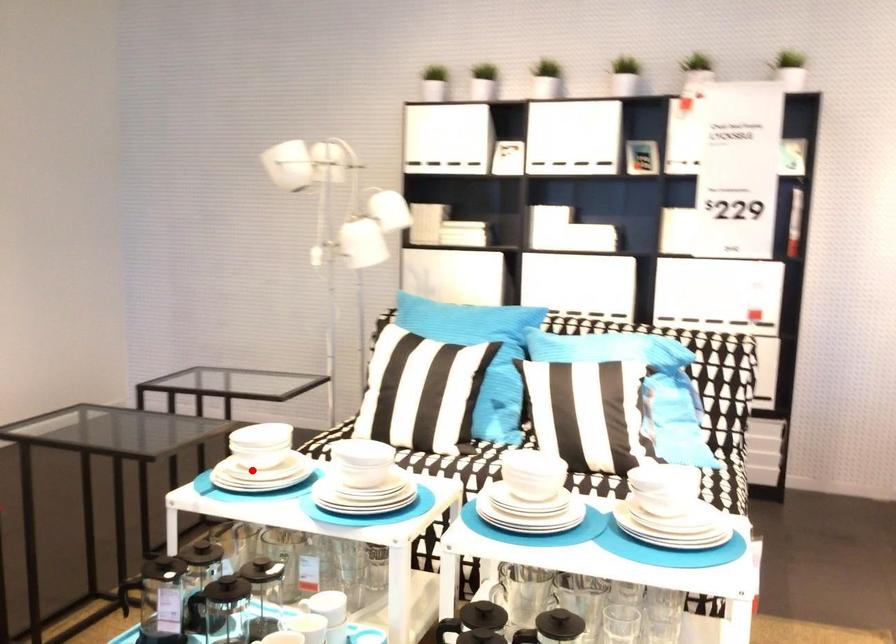
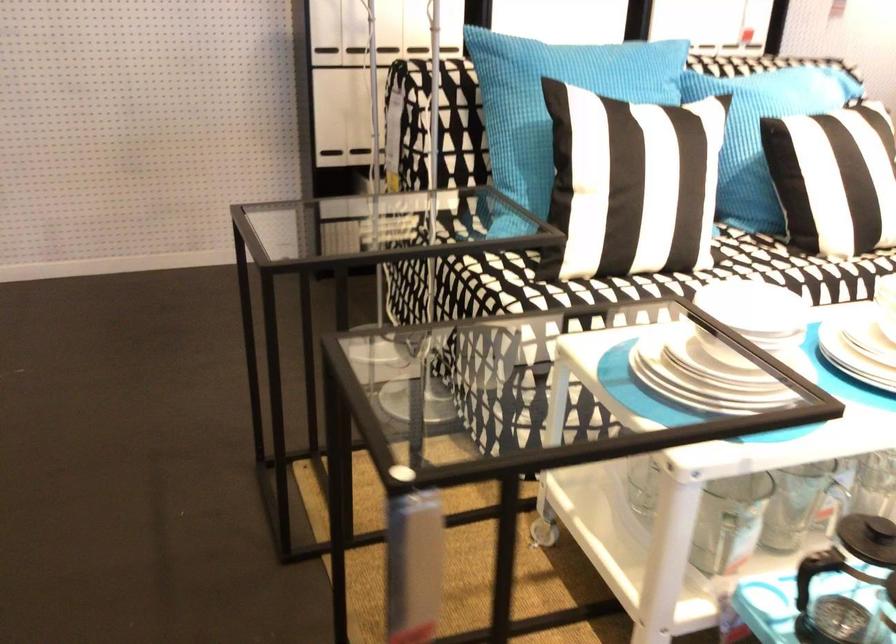
Question: A red point is marked in image1. In image2, is the corresponding 3D point closer to the camera or farther? Reply with the corresponding letter.

Choices:
 (A) The corresponding 3D point is closer.
 (B) The corresponding 3D point is farther.

Answer: (A)